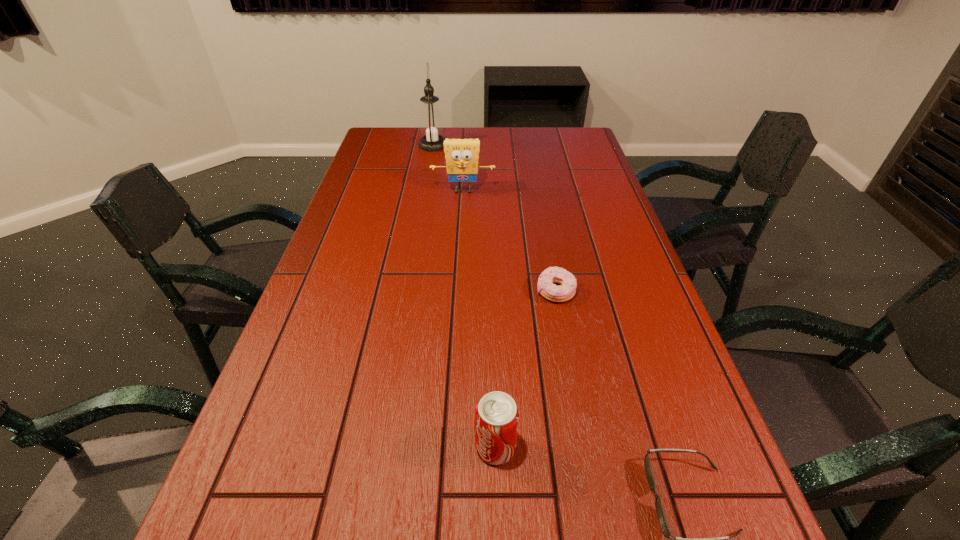
At what (x,y) coordinates should I click in order to perform the action: click on the tallest object. Please return your answer as a coordinate pair (x, y). The height and width of the screenshot is (540, 960). Looking at the image, I should click on (431, 124).

Where is `oil lamp`? oil lamp is located at coordinates (431, 124).

The width and height of the screenshot is (960, 540). I want to click on the second tallest object, so click(461, 155).

You are a GUI agent. You are given a task and a screenshot of the screen. Output one action in this format:
    pyautogui.click(x=<x>, y=<y>)
    Task: Click on the sponge
    Image resolution: width=960 pixels, height=540 pixels.
    Given the screenshot: What is the action you would take?
    pos(461,155)

The width and height of the screenshot is (960, 540). I want to click on soda can, so click(497, 416).

I want to click on the second object from right to left, so click(550, 291).

This screenshot has width=960, height=540. In order to click on the second shortest object in this screenshot , I will do `click(550, 291)`.

Find the location of a particular element. The height and width of the screenshot is (540, 960). free spot located on the front of the tallest object is located at coordinates (424, 193).

The image size is (960, 540). Find the location of `vacant space located 0.160m on the face of the sponge`. vacant space located 0.160m on the face of the sponge is located at coordinates (461, 226).

The width and height of the screenshot is (960, 540). What are the coordinates of `vacant space located 0.120m on the right of the third tallest object` in the screenshot? It's located at (581, 448).